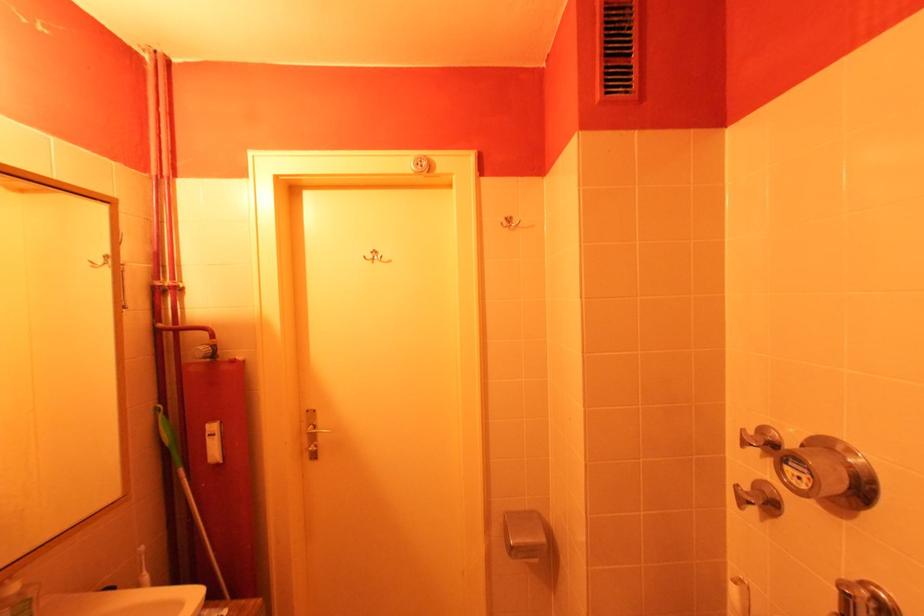
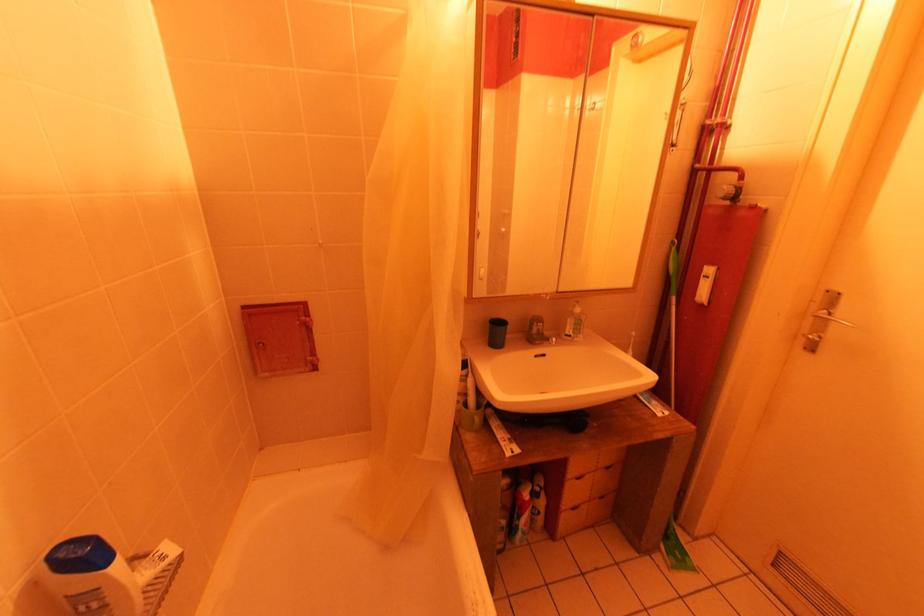
The first image is from the beginning of the video and the second image is from the end. How did the camera likely rotate when shooting the video?

The rotation direction of the camera is left-down.